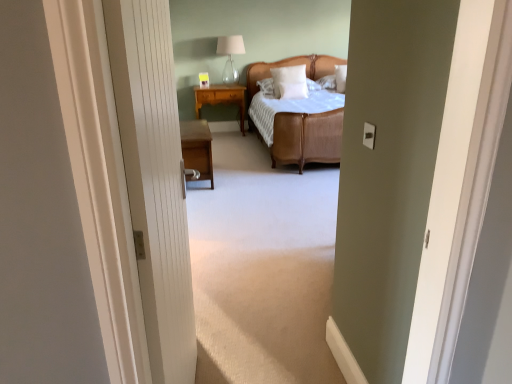
Question: Is the depth of light brown wood nightstand at center, which is counted as the second nightstand, starting from the bottom, less than that of white soft pillow at center, the first pillow ordered from the bottom?

Choices:
 (A) yes
 (B) no

Answer: (B)

Question: Considering the relative sizes of light brown wood nightstand at center, the first nightstand when ordered from back to front, and white soft pillow at center, the 2th pillow from the top, in the image provided, is light brown wood nightstand at center, the first nightstand when ordered from back to front, bigger than white soft pillow at center, the 2th pillow from the top,?

Choices:
 (A) yes
 (B) no

Answer: (A)

Question: From a real-world perspective, is light brown wood nightstand at center, the 1th nightstand when ordered from top to bottom, on white soft pillow at center, the first pillow ordered from the bottom?

Choices:
 (A) no
 (B) yes

Answer: (A)

Question: Is light brown wood nightstand at center, the first nightstand when ordered from back to front, taller than white soft pillow at center, the 2th pillow from the top?

Choices:
 (A) no
 (B) yes

Answer: (B)

Question: Is light brown wood nightstand at center, the 1th nightstand when ordered from top to bottom, facing towards white soft pillow at center, the 2th pillow from the top?

Choices:
 (A) no
 (B) yes

Answer: (A)

Question: Is light brown wood nightstand at center, the 1th nightstand when ordered from top to bottom, wider than white soft pillow at center, the 2th pillow from the top?

Choices:
 (A) no
 (B) yes

Answer: (B)

Question: Is woven rattan bed at center located outside white textured door at center?

Choices:
 (A) yes
 (B) no

Answer: (A)

Question: Is the position of woven rattan bed at center more distant than that of white textured door at center?

Choices:
 (A) no
 (B) yes

Answer: (B)

Question: Considering the relative sizes of woven rattan bed at center and white textured door at center in the image provided, is woven rattan bed at center smaller than white textured door at center?

Choices:
 (A) no
 (B) yes

Answer: (A)

Question: From a real-world perspective, is woven rattan bed at center over white textured door at center?

Choices:
 (A) yes
 (B) no

Answer: (B)

Question: Is woven rattan bed at center thinner than white textured door at center?

Choices:
 (A) yes
 (B) no

Answer: (B)

Question: Does woven rattan bed at center appear on the right side of white textured door at center?

Choices:
 (A) no
 (B) yes

Answer: (B)

Question: From a real-world perspective, is light brown wood nightstand at center, the 1th nightstand when ordered from top to bottom, over white soft pillow at center, which is counted as the second pillow, starting from the bottom?

Choices:
 (A) yes
 (B) no

Answer: (B)